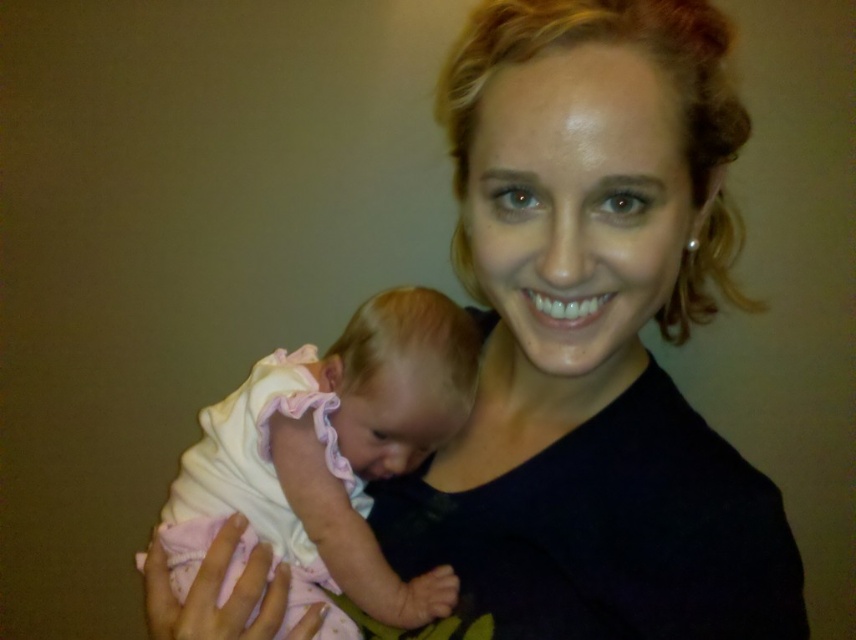
Is white soft fabric baby at left below pink fabric baby at center?

Incorrect, white soft fabric baby at left is not positioned below pink fabric baby at center.

Which is in front, point (349, 460) or point (420, 602)?

Point (420, 602) is in front.

The width and height of the screenshot is (856, 640). Find the location of `white soft fabric baby at left`. white soft fabric baby at left is located at coordinates (333, 451).